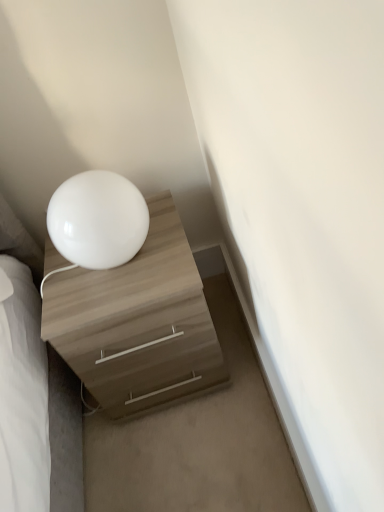
I want to click on empty space that is ontop of matte wood chest of drawers at lower left, so click(117, 274).